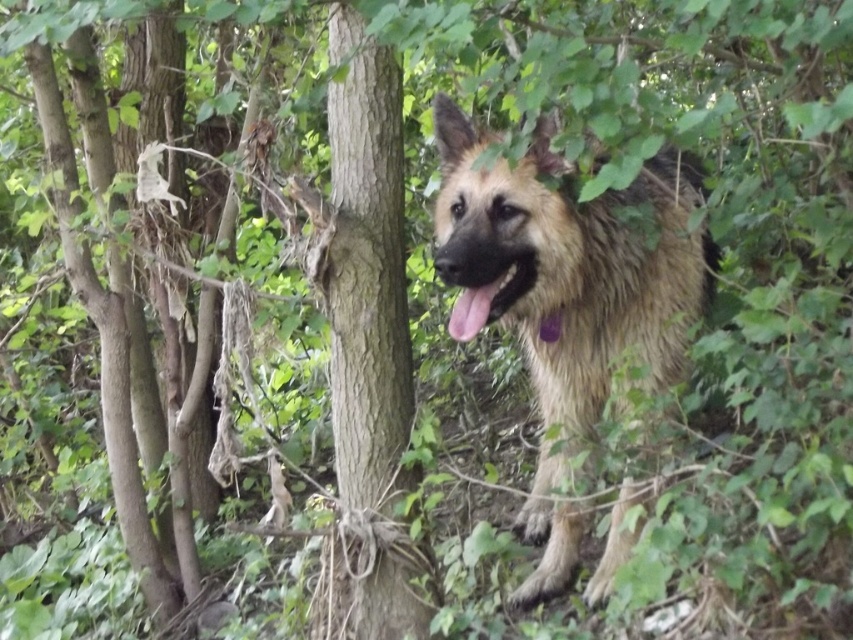
You are a photographer trying to capture the fuzzy brown dog at center and its black glossy tongue at center. Based on their positions, which one should you focus on first to ensure both are in frame?

The fuzzy brown dog at center is below the black glossy tongue at center, so you should focus on the black glossy tongue at center first to ensure both are in frame.

You are a photographer trying to capture the fuzzy brown dog at center and the black glossy tongue at center in a clear photo. Which object should you focus on first to ensure both are in focus?

The fuzzy brown dog at center is in front of the black glossy tongue at center, so you should focus on the fuzzy brown dog at center first to ensure both are in focus.

You are a wildlife photographer trying to capture a clear shot of the fuzzy brown dog at center and the black glossy tongue at center. Given that your camera can only focus on objects wider than 10 cm, will both subjects be in focus?

The fuzzy brown dog at center is wider than the black glossy tongue at center. Since the camera focuses on objects wider than 10 cm, the fuzzy brown dog at center will be in focus, but the black glossy tongue at center may not be if its width is less than 10 cm. However, the exact width of the tongue isn